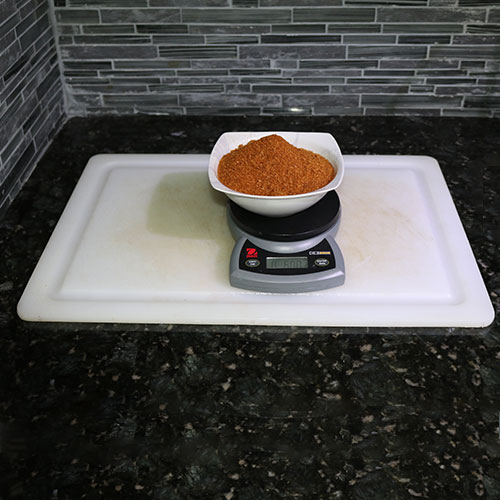
Image resolution: width=500 pixels, height=500 pixels. Identify the location of scale display. (287, 265).